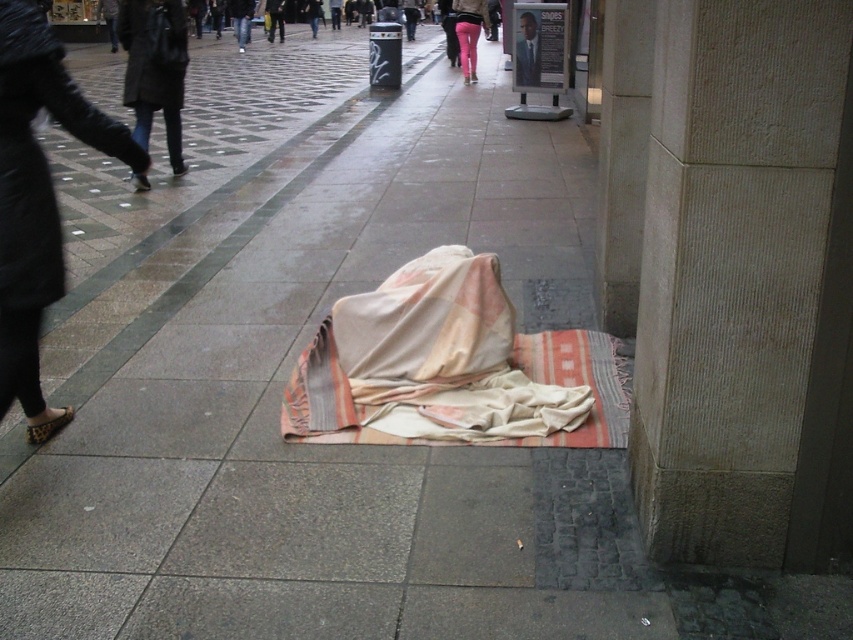
You are a delivery robot navigating a rainy city sidewalk. You need to deliver a package to a location marked by the point at coordinates point (746, 285). There is a person lying on the ground covered by a light blanket. Can you safely pass around the person without disturbing them?

The point at coordinates point (746, 285) is on a smooth stone pillar at center right. Since the person is lying on the ground at the foreground, you can safely navigate around them by moving towards the smooth stone pillar at center right, ensuring you avoid the person.

You are a delivery person who needs to place a package between the beige woven blanket at center and the dark gray coat at left. The package is 10 feet long. Is there enough space between them to place the package without moving either object?

The beige woven blanket at center is 15.84 feet from the dark gray coat at left. Since the package is 10 feet long, there is sufficient space between them to place the package without moving either object.

You are a delivery person who needs to place a small package between the smooth stone pillar at center right and the leather shoe at lower left. Which object should you use as a reference point to ensure the package is placed closer to the taller object?

The smooth stone pillar at center right is taller than the leather shoe at lower left, so you should use the smooth stone pillar at center right as the reference point to place the package closer to it.